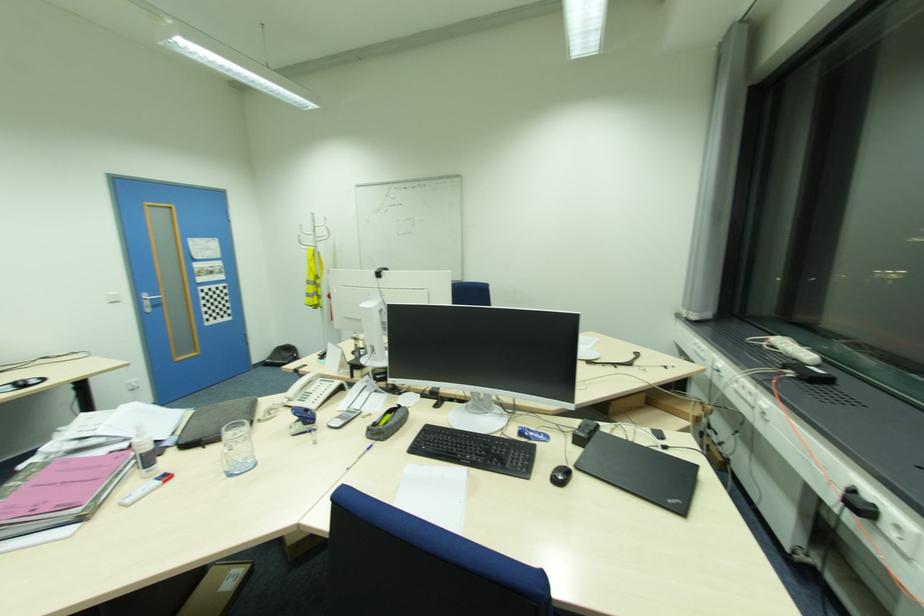
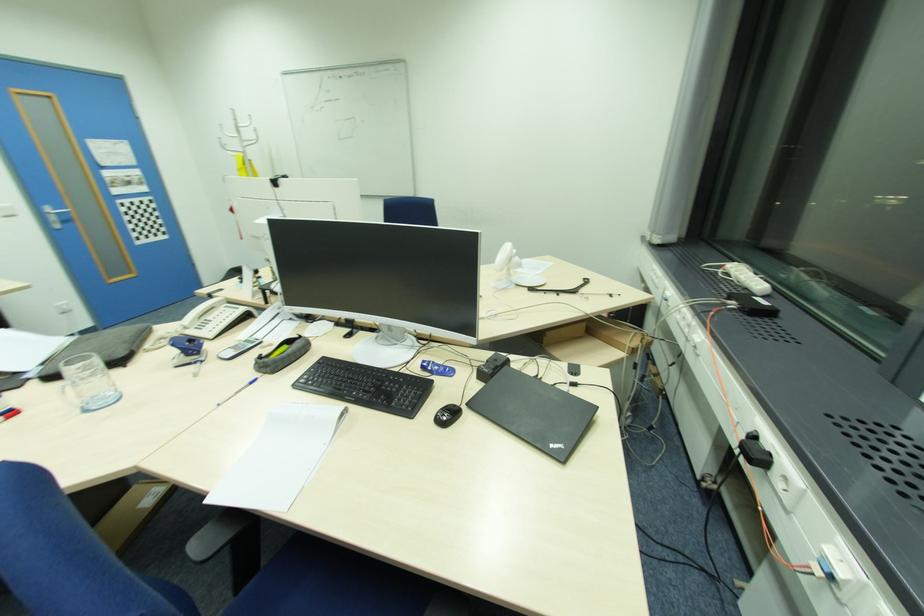
The point at (x=601, y=432) is marked in the first image. Where is the corresponding point in the second image?

(508, 367)